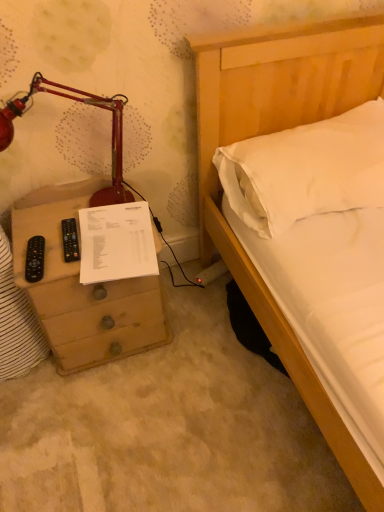
Where is `empty space that is ontop of wooden chest of drawers at left`? The height and width of the screenshot is (512, 384). empty space that is ontop of wooden chest of drawers at left is located at coordinates (83, 233).